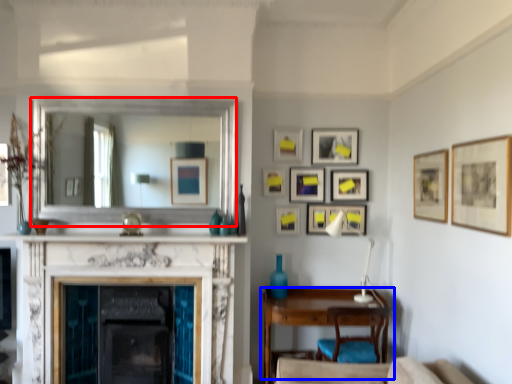
Question: Among these objects, which one is nearest to the camera, mirror (highlighted by a red box) or table (highlighted by a blue box)?

Choices:
 (A) mirror
 (B) table

Answer: (B)